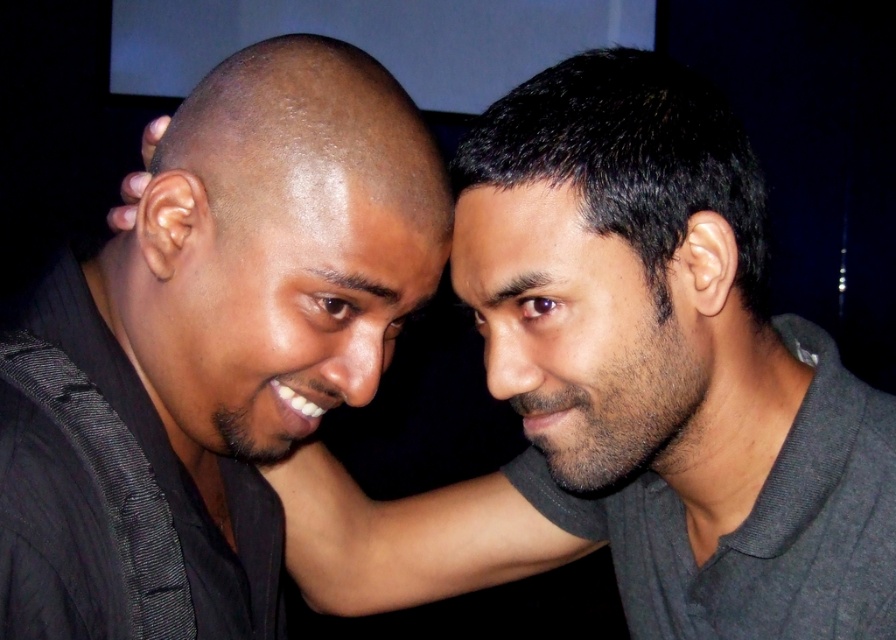
Question: Which object appears farthest from the camera in this image?

Choices:
 (A) smooth skin at center
 (B) black matte shirt at left
 (C) smooth black shirt at left

Answer: (A)

Question: Among these points, which one is nearest to the camera?

Choices:
 (A) (224, 92)
 (B) (771, 388)
 (C) (349, 506)

Answer: (A)

Question: Can you confirm if smooth black shirt at left is smaller than smooth skin at center?

Choices:
 (A) yes
 (B) no

Answer: (B)

Question: Which point appears farthest from the camera in this image?

Choices:
 (A) (449, 554)
 (B) (363, 348)
 (C) (556, 292)

Answer: (A)

Question: Is smooth black shirt at left bigger than smooth skin at center?

Choices:
 (A) no
 (B) yes

Answer: (B)

Question: Is black matte shirt at left smaller than smooth skin at center?

Choices:
 (A) yes
 (B) no

Answer: (B)